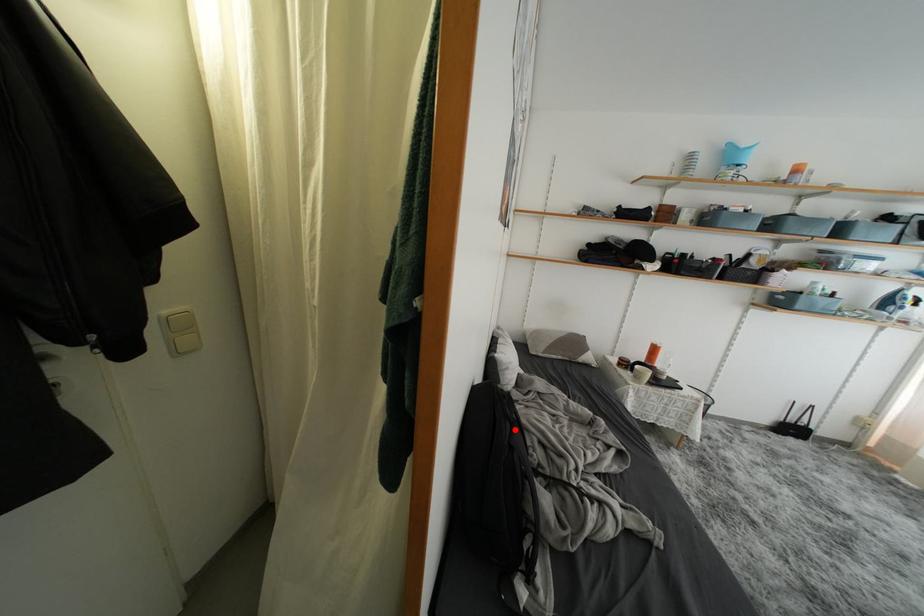
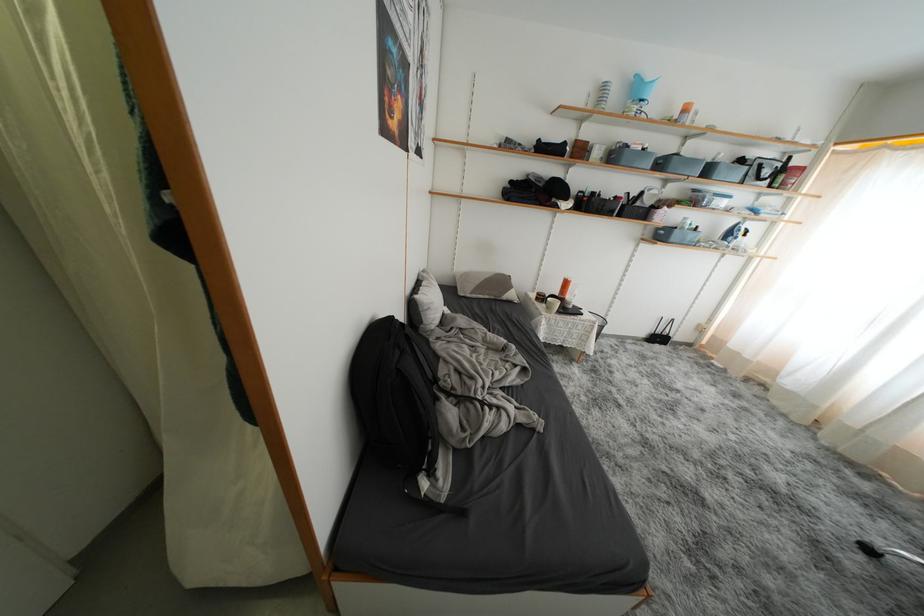
Find the pixel in the second image that matches the highlighted location in the first image.

(404, 357)